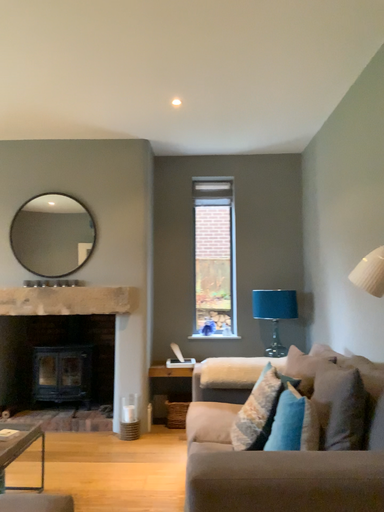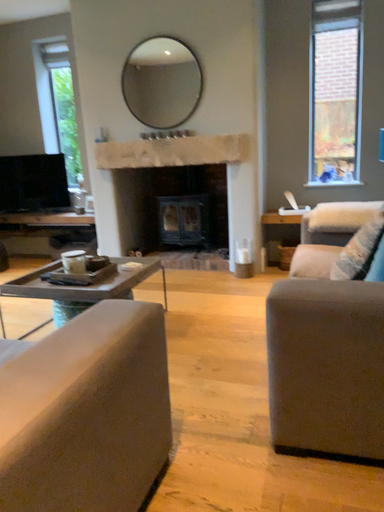
Question: How did the camera likely rotate when shooting the video?

Choices:
 (A) rotated downward
 (B) rotated upward

Answer: (A)